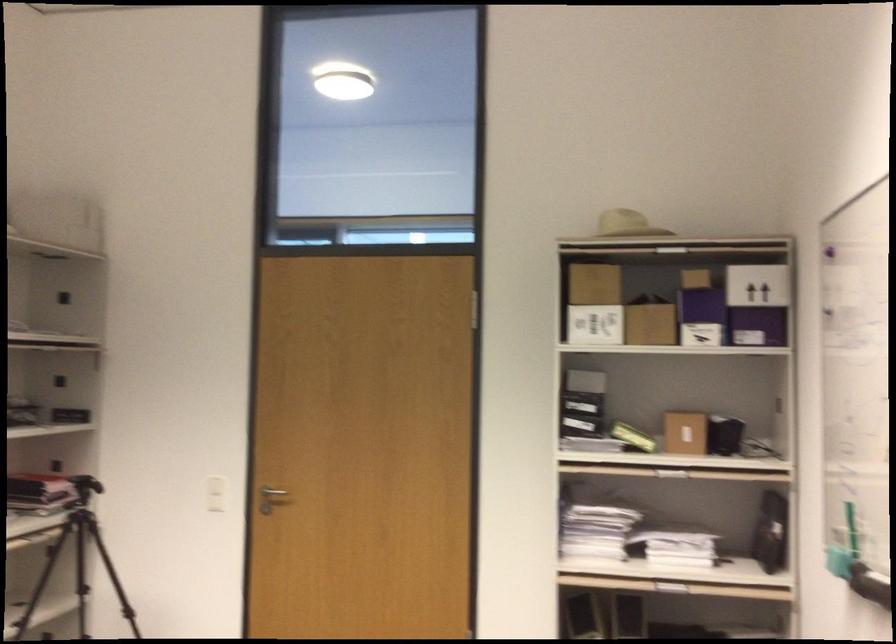
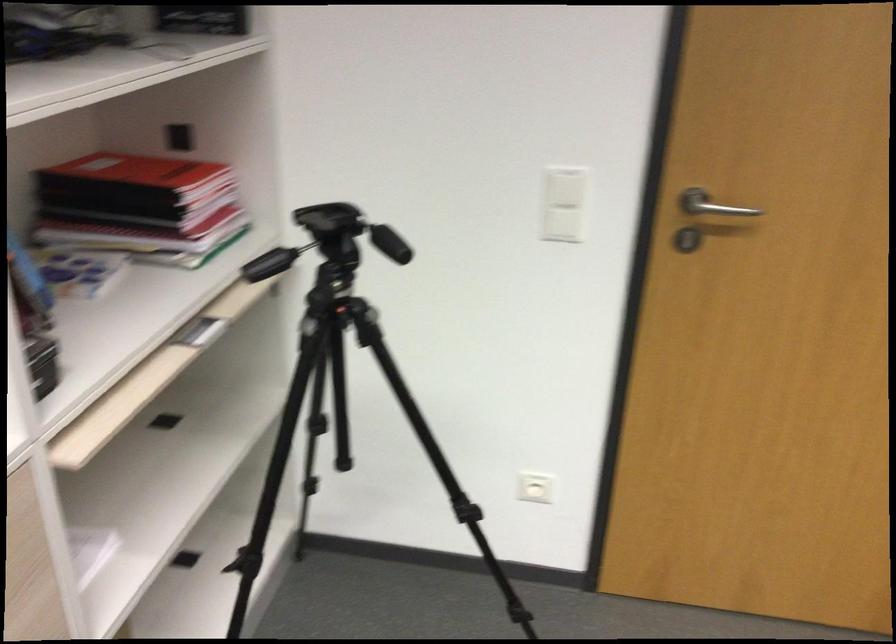
The point at (222, 482) is marked in the first image. Where is the corresponding point in the second image?

(565, 187)